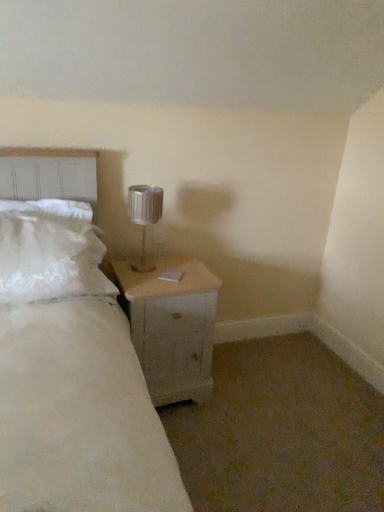
Question: From the image's perspective, does metallic silver lamp at upper right appear higher than white fluffy pillow at left?

Choices:
 (A) no
 (B) yes

Answer: (B)

Question: Considering the relative sizes of metallic silver lamp at upper right and white fluffy pillow at left in the image provided, is metallic silver lamp at upper right smaller than white fluffy pillow at left?

Choices:
 (A) no
 (B) yes

Answer: (B)

Question: Does metallic silver lamp at upper right have a greater height compared to white fluffy pillow at left?

Choices:
 (A) no
 (B) yes

Answer: (A)

Question: Could you tell me if metallic silver lamp at upper right is turned towards white fluffy pillow at left?

Choices:
 (A) no
 (B) yes

Answer: (A)

Question: Can you confirm if metallic silver lamp at upper right is wider than white fluffy pillow at left?

Choices:
 (A) no
 (B) yes

Answer: (A)

Question: From a real-world perspective, is white wood nightstand at lower right above or below white fluffy pillow at left?

Choices:
 (A) below
 (B) above

Answer: (A)

Question: Looking at their shapes, would you say white wood nightstand at lower right is wider or thinner than white fluffy pillow at left?

Choices:
 (A) thin
 (B) wide

Answer: (B)

Question: Relative to white fluffy pillow at left, is white wood nightstand at lower right in front or behind?

Choices:
 (A) front
 (B) behind

Answer: (B)

Question: Is point (210, 350) positioned closer to the camera than point (52, 261)?

Choices:
 (A) closer
 (B) farther

Answer: (B)

Question: Based on their positions, is metallic silver lamp at upper right located to the left or right of white fluffy pillow at left?

Choices:
 (A) right
 (B) left

Answer: (A)

Question: Is metallic silver lamp at upper right taller or shorter than white fluffy pillow at left?

Choices:
 (A) tall
 (B) short

Answer: (B)

Question: Is metallic silver lamp at upper right bigger or smaller than white fluffy pillow at left?

Choices:
 (A) big
 (B) small

Answer: (B)

Question: Looking at their shapes, would you say metallic silver lamp at upper right is wider or thinner than white fluffy pillow at left?

Choices:
 (A) wide
 (B) thin

Answer: (B)

Question: From a real-world perspective, relative to metallic silver lamp at upper right, is white wood nightstand at lower right vertically above or below?

Choices:
 (A) above
 (B) below

Answer: (B)

Question: In the image, is white wood nightstand at lower right positioned in front of or behind metallic silver lamp at upper right?

Choices:
 (A) front
 (B) behind

Answer: (A)